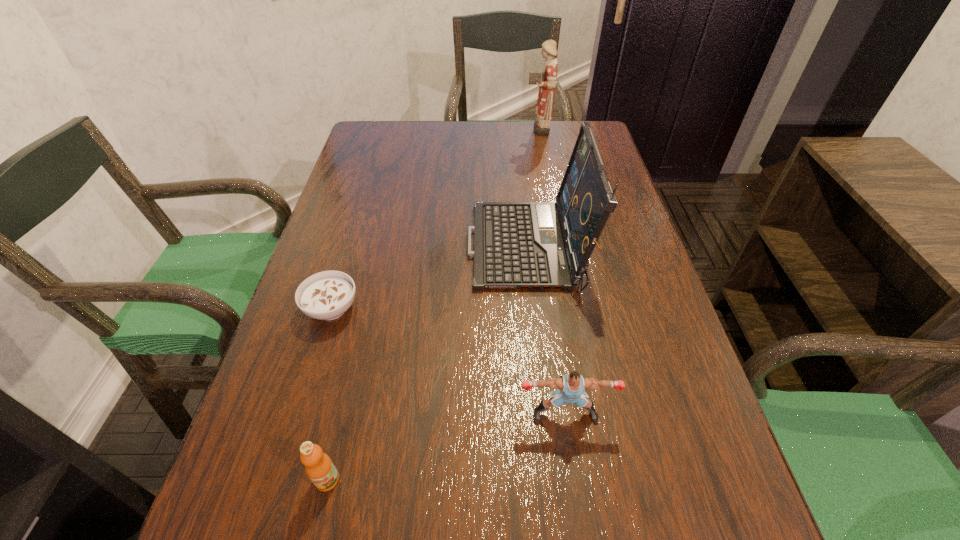
What are the coordinates of `the farthest object` in the screenshot? It's located at (546, 80).

Where is `laptop computer`? laptop computer is located at coordinates (517, 245).

The image size is (960, 540). What are the coordinates of `puncher` in the screenshot? It's located at (571, 387).

At what (x,y) coordinates should I click in order to perform the action: click on the nearest object. Please return your answer as a coordinate pair (x, y). The image size is (960, 540). Looking at the image, I should click on (320, 469).

At what (x,y) coordinates should I click in order to perform the action: click on the shortest object. Please return your answer as a coordinate pair (x, y). Image resolution: width=960 pixels, height=540 pixels. Looking at the image, I should click on (327, 295).

Find the location of a particular element. The height and width of the screenshot is (540, 960). vacant space located 0.180m on the front-facing side of the farthest object is located at coordinates (469, 127).

Find the location of a particular element. The width and height of the screenshot is (960, 540). free space located on the front-facing side of the farthest object is located at coordinates (451, 127).

Image resolution: width=960 pixels, height=540 pixels. Find the location of `free region located on the front-facing side of the farthest object`. free region located on the front-facing side of the farthest object is located at coordinates (491, 127).

In order to click on vacant space located 0.120m on the front-facing side of the laptop computer in this screenshot , I will do coord(418,248).

The height and width of the screenshot is (540, 960). Identify the location of free spot located on the front-facing side of the laptop computer. (443, 248).